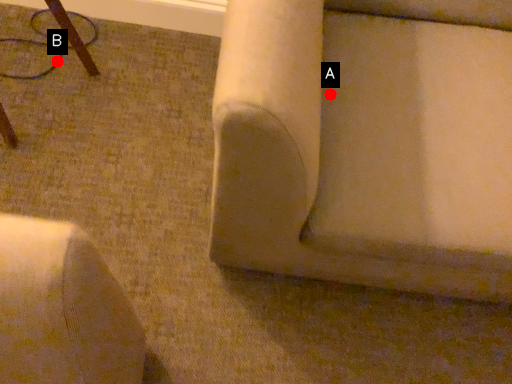
Question: Two points are circled on the image, labeled by A and B beside each circle. Which of the following is the farthest from the observer?

Choices:
 (A) A is further
 (B) B is further

Answer: (B)